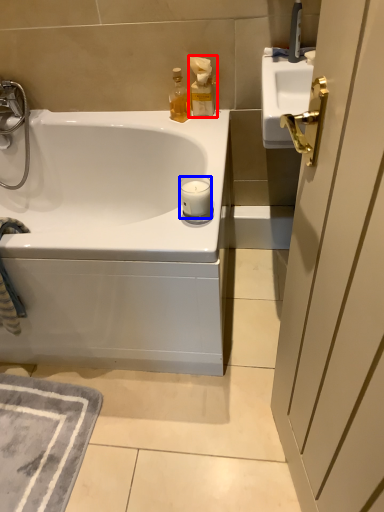
Question: Which of the following is the farthest to the observer, bottle (highlighted by a red box) or candle (highlighted by a blue box)?

Choices:
 (A) bottle
 (B) candle

Answer: (A)